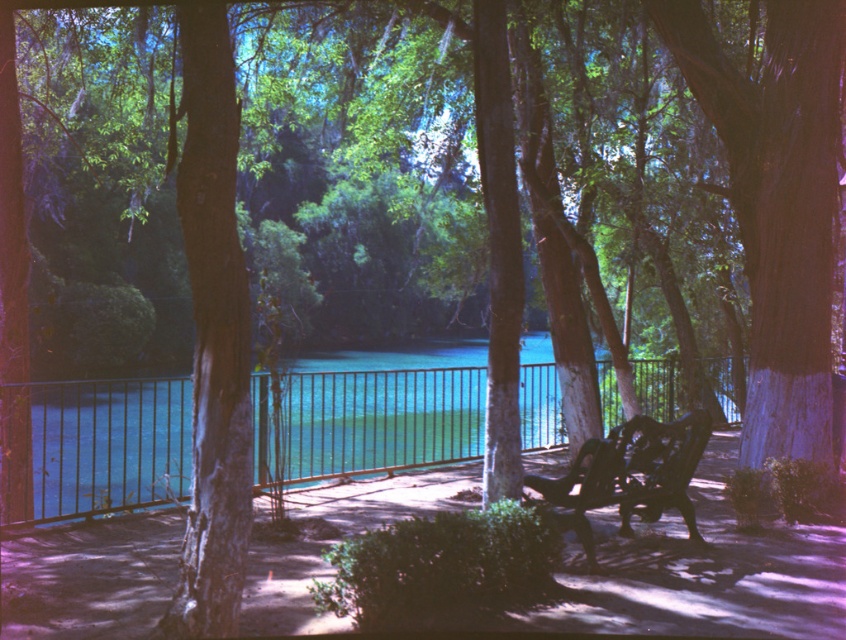
Is teal glass water at center above dark brown wood bench at center?

Yes.

Is teal glass water at center taller than dark brown wood bench at center?

Yes.

Identify the location of teal glass water at center. The width and height of the screenshot is (846, 640). (97, 448).

Identify the location of teal glass water at center. (97, 448).